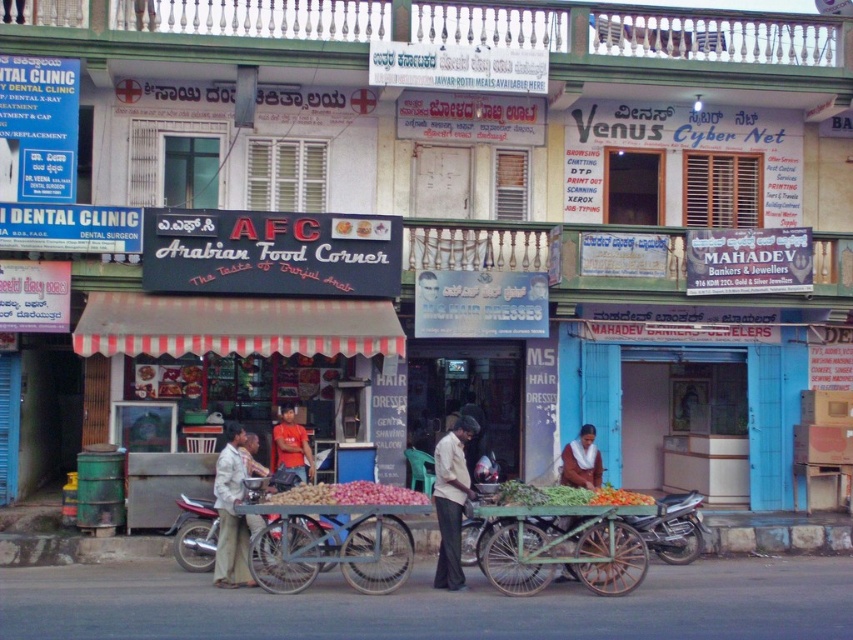
You are a customer looking to buy onions from the vendor. You see the pink matte onions at center and light beige fabric pants at center. Which item is positioned higher?

The pink matte onions at center are positioned higher than the light beige fabric pants at center.